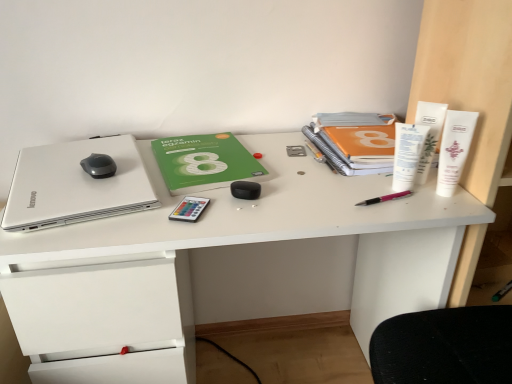
Locate an element on the screen. This screenshot has height=384, width=512. black plastic remote control at center-left, positioned as the fifth stationery in right-to-left order is located at coordinates (189, 209).

This screenshot has height=384, width=512. Describe the element at coordinates (189, 209) in the screenshot. I see `black plastic remote control at center-left, positioned as the fifth stationery in right-to-left order` at that location.

Image resolution: width=512 pixels, height=384 pixels. In order to click on green matte paperback book at center, which appears as the 1th paperback book when viewed from the left in this screenshot , I will do `click(204, 162)`.

What is the approximate height of white plastic tubes at right?

It is 3.37 feet.

Locate an element on the screen. The image size is (512, 384). white plastic tube at upper right, placed as the first stationery when sorted from right to left is located at coordinates (454, 149).

At what (x,y) coordinates should I click in order to perform the action: click on pink metallic pen at center-right, which is the second stationery in left-to-right order. Please return your answer as a coordinate pair (x, y). Image resolution: width=512 pixels, height=384 pixels. Looking at the image, I should click on (384, 198).

Does point (263, 227) lie behind point (194, 204)?

No, (263, 227) is closer to viewer.

Considering the positions of objects white matte desk at center and black plastic remote control at center-left, the 1th stationery in the left-to-right sequence, in the image provided, who is in front, white matte desk at center or black plastic remote control at center-left, the 1th stationery in the left-to-right sequence,?

white matte desk at center is in front.

Would you say white matte desk at center contains black plastic remote control at center-left, the 1th stationery in the left-to-right sequence?

That's correct, black plastic remote control at center-left, the 1th stationery in the left-to-right sequence, is inside white matte desk at center.

Considering the sizes of objects white matte desk at center and black plastic remote control at center-left, the 1th stationery in the left-to-right sequence, in the image provided, who is shorter, white matte desk at center or black plastic remote control at center-left, the 1th stationery in the left-to-right sequence,?

Standing shorter between the two is black plastic remote control at center-left, the 1th stationery in the left-to-right sequence.

Is black plastic remote control at center-left, the 1th stationery in the left-to-right sequence, not inside green matte paperback book at center, which appears as the 1th paperback book when viewed from the left?

Indeed, black plastic remote control at center-left, the 1th stationery in the left-to-right sequence, is completely outside green matte paperback book at center, which appears as the 1th paperback book when viewed from the left.

Does black plastic remote control at center-left, positioned as the fifth stationery in right-to-left order, turn towards green matte paperback book at center, which is the second paperback book in right-to-left order?

No, black plastic remote control at center-left, positioned as the fifth stationery in right-to-left order, is not oriented towards green matte paperback book at center, which is the second paperback book in right-to-left order.

Identify the location of the 1st paperback book above the black plastic remote control at center-left, positioned as the fifth stationery in right-to-left order (from the image's perspective). Image resolution: width=512 pixels, height=384 pixels. (204, 162).

Between white plastic tubes at right, the 3th stationery positioned from the right, and black plastic remote control at center-left, positioned as the fifth stationery in right-to-left order, which one is positioned in front?

black plastic remote control at center-left, positioned as the fifth stationery in right-to-left order, is more forward.

From the image's perspective, who appears lower, white plastic tubes at right, the 3th stationery positioned from the right, or black plastic remote control at center-left, the 1th stationery in the left-to-right sequence?

black plastic remote control at center-left, the 1th stationery in the left-to-right sequence, appears lower in the image.

From a real-world perspective, is white plastic tubes at right, the 3th stationery positioned from the right, physically located above or below black plastic remote control at center-left, positioned as the fifth stationery in right-to-left order?

From a real-world perspective, white plastic tubes at right, the 3th stationery positioned from the right, is physically above black plastic remote control at center-left, positioned as the fifth stationery in right-to-left order.

Starting from the black plastic remote control at center-left, the 1th stationery in the left-to-right sequence, which stationery is the 2nd one to the right? Please provide its 2D coordinates.

[(407, 154)]

From a real-world perspective, between pink metallic pen at center-right, which ranks as the 4th stationery in right-to-left order, and black rubberized mouse at upper left, who is vertically higher?

black rubberized mouse at upper left, from a real-world perspective.

Where is `mouse that appears above the pink metallic pen at center-right, which is the second stationery in left-to-right order (from a real-world perspective)`? The width and height of the screenshot is (512, 384). mouse that appears above the pink metallic pen at center-right, which is the second stationery in left-to-right order (from a real-world perspective) is located at coordinates (99, 166).

Is pink metallic pen at center-right, which ranks as the 4th stationery in right-to-left order, positioned beyond the bounds of black rubberized mouse at upper left?

pink metallic pen at center-right, which ranks as the 4th stationery in right-to-left order, is positioned outside black rubberized mouse at upper left.

From a real-world perspective, which is physically below, white matte laptop at left or green matte paperback book at center, which is the second paperback book in right-to-left order?

From a 3D spatial view, green matte paperback book at center, which is the second paperback book in right-to-left order, is below.

Who is smaller, white matte laptop at left or green matte paperback book at center, which appears as the 1th paperback book when viewed from the left?

green matte paperback book at center, which appears as the 1th paperback book when viewed from the left, is smaller.

In terms of width, does white matte laptop at left look wider or thinner when compared to green matte paperback book at center, which is the second paperback book in right-to-left order?

Clearly, white matte laptop at left has more width compared to green matte paperback book at center, which is the second paperback book in right-to-left order.

In the scene shown: Considering the sizes of objects white plastic tubes at right, which is the third stationery from left to right, and pink metallic pen at center-right, which ranks as the 4th stationery in right-to-left order, in the image provided, who is shorter, white plastic tubes at right, which is the third stationery from left to right, or pink metallic pen at center-right, which ranks as the 4th stationery in right-to-left order,?

Standing shorter between the two is pink metallic pen at center-right, which ranks as the 4th stationery in right-to-left order.

The width and height of the screenshot is (512, 384). I want to click on stationery that is the 1st object located above the pink metallic pen at center-right, which is the second stationery in left-to-right order (from the image's perspective), so click(407, 154).

Consider the image. Can you confirm if white plastic tubes at right, the 3th stationery positioned from the right, is positioned to the left of pink metallic pen at center-right, which is the second stationery in left-to-right order?

No.

Which is behind, white plastic tubes at right, the 3th stationery positioned from the right, or pink metallic pen at center-right, which ranks as the 4th stationery in right-to-left order?

pink metallic pen at center-right, which ranks as the 4th stationery in right-to-left order, is behind.

Is white plastic tube at upper right, which is the fifth stationery in left-to-right order, wider than orange matte notebook at upper right, acting as the 1th paperback book starting from the right?

Incorrect, the width of white plastic tube at upper right, which is the fifth stationery in left-to-right order, does not surpass that of orange matte notebook at upper right, acting as the 1th paperback book starting from the right.

From the image's perspective, is white plastic tube at upper right, which is the fifth stationery in left-to-right order, above or below orange matte notebook at upper right, which is the 2th paperback book in left-to-right order?

From the image's perspective, white plastic tube at upper right, which is the fifth stationery in left-to-right order, appears below orange matte notebook at upper right, which is the 2th paperback book in left-to-right order.

This screenshot has height=384, width=512. Find the location of `the 5th stationery in front when counting from the orange matte notebook at upper right, which is the 2th paperback book in left-to-right order`. the 5th stationery in front when counting from the orange matte notebook at upper right, which is the 2th paperback book in left-to-right order is located at coordinates (454, 149).

In the scene shown: Is white plastic tube at upper right, which is the fifth stationery in left-to-right order, taller than orange matte notebook at upper right, which is the 2th paperback book in left-to-right order?

Yes, white plastic tube at upper right, which is the fifth stationery in left-to-right order, is taller than orange matte notebook at upper right, which is the 2th paperback book in left-to-right order.

Image resolution: width=512 pixels, height=384 pixels. In order to click on desk lying on the right of black plastic remote control at center-left, positioned as the fifth stationery in right-to-left order in this screenshot , I will do click(x=231, y=258).

Locate an element on the screen. the 4th stationery in front of the green matte paperback book at center, which appears as the 1th paperback book when viewed from the left, starting your count from the anchor is located at coordinates point(189,209).

From the image, which object appears to be nearer to white plastic tube at upper right, the 2th stationery positioned from the right, green matte paperback book at center, which is the second paperback book in right-to-left order, or black plastic remote control at center-left, the 1th stationery in the left-to-right sequence?

The object closer to white plastic tube at upper right, the 2th stationery positioned from the right, is green matte paperback book at center, which is the second paperback book in right-to-left order.

From the image, which object appears to be farther from green matte paperback book at center, which is the second paperback book in right-to-left order, orange matte notebook at upper right, acting as the 1th paperback book starting from the right, or white plastic tube at upper right, which ranks as the 4th stationery in left-to-right order?

white plastic tube at upper right, which ranks as the 4th stationery in left-to-right order, lies further to green matte paperback book at center, which is the second paperback book in right-to-left order, than the other object.

From the picture: Based on their spatial positions, is white matte desk at center or green matte paperback book at center, which is the second paperback book in right-to-left order, further from white plastic tubes at right?

The object further to white plastic tubes at right is green matte paperback book at center, which is the second paperback book in right-to-left order.

Looking at the image, which one is located closer to pink metallic pen at center-right, which ranks as the 4th stationery in right-to-left order, white matte laptop at left or white plastic tubes at right?

white plastic tubes at right lies closer to pink metallic pen at center-right, which ranks as the 4th stationery in right-to-left order, than the other object.

From the picture: Estimate the real-world distances between objects in this image. Which object is further from white plastic tube at upper right, placed as the first stationery when sorted from right to left, black plastic remote control at center-left, the 1th stationery in the left-to-right sequence, or white matte laptop at left?

The object further to white plastic tube at upper right, placed as the first stationery when sorted from right to left, is white matte laptop at left.

From the image, which object appears to be nearer to orange matte notebook at upper right, acting as the 1th paperback book starting from the right, black rubberized mouse at upper left or green matte paperback book at center, which appears as the 1th paperback book when viewed from the left?

Based on the image, green matte paperback book at center, which appears as the 1th paperback book when viewed from the left, appears to be nearer to orange matte notebook at upper right, acting as the 1th paperback book starting from the right.

Considering their positions, is white plastic tube at upper right, placed as the first stationery when sorted from right to left, positioned further to black rubberized mouse at upper left than orange matte notebook at upper right, which is the 2th paperback book in left-to-right order?

The object further to black rubberized mouse at upper left is white plastic tube at upper right, placed as the first stationery when sorted from right to left.

Based on their spatial positions, is black plastic remote control at center-left, the 1th stationery in the left-to-right sequence, or white plastic tube at upper right, placed as the first stationery when sorted from right to left, closer to white matte laptop at left?

black plastic remote control at center-left, the 1th stationery in the left-to-right sequence.

At what (x,y) coordinates should I click in order to perform the action: click on laptop between black rubberized mouse at upper left and white matte desk at center in the vertical direction. Please return your answer as a coordinate pair (x, y). The height and width of the screenshot is (384, 512). Looking at the image, I should click on (76, 185).

Locate an element on the screen. This screenshot has width=512, height=384. mouse between white matte laptop at left and white plastic tubes at right, which is the third stationery from left to right, in the horizontal direction is located at coordinates (99, 166).

Where is `desk located between green matte paperback book at center, which is the second paperback book in right-to-left order, and white plastic tubes at right, the 3th stationery positioned from the right, in the left-right direction`? This screenshot has width=512, height=384. desk located between green matte paperback book at center, which is the second paperback book in right-to-left order, and white plastic tubes at right, the 3th stationery positioned from the right, in the left-right direction is located at coordinates (231, 258).

This screenshot has width=512, height=384. What are the coordinates of `desk between black rubberized mouse at upper left and white plastic tube at upper right, which ranks as the 4th stationery in left-to-right order, in the horizontal direction` in the screenshot? It's located at (231, 258).